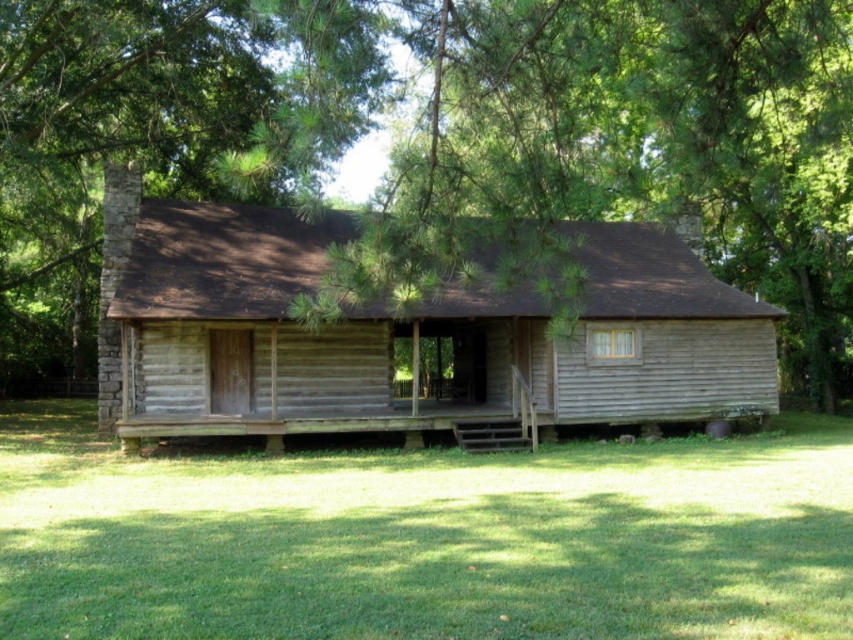
Describe the element at coordinates (158, 125) in the screenshot. I see `green leafy tree at center` at that location.

Can you confirm if green leafy tree at center is positioned above weathered wood cabin at center?

Correct, green leafy tree at center is located above weathered wood cabin at center.

Is point (651, 144) farther from viewer compared to point (701, 339)?

Yes, it is behind point (701, 339).

Locate an element on the screen. This screenshot has height=640, width=853. green leafy tree at center is located at coordinates (158, 125).